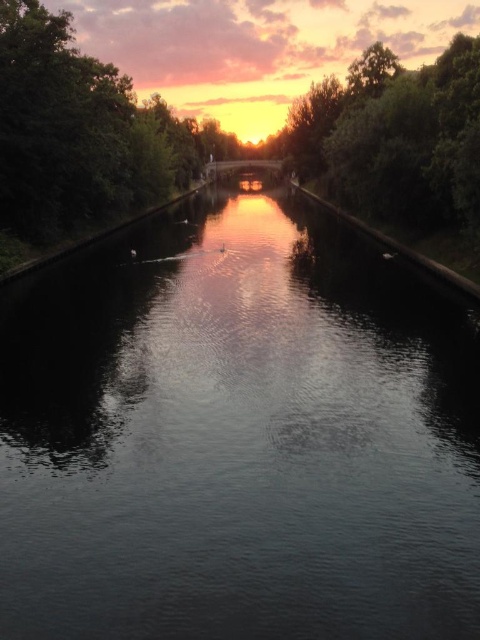
Measure the distance between dark reflective water at center and camera.

28.74 feet

Is dark reflective water at center thinner than green leafy tree at center?

Correct, dark reflective water at center's width is less than green leafy tree at center's.

Describe the element at coordinates (238, 435) in the screenshot. This screenshot has height=640, width=480. I see `dark reflective water at center` at that location.

The width and height of the screenshot is (480, 640). In order to click on dark reflective water at center in this screenshot , I will do `click(238, 435)`.